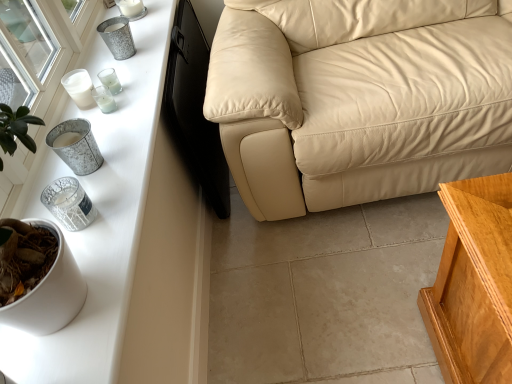
You are a GUI agent. You are given a task and a screenshot of the screen. Output one action in this format:
    pyautogui.click(x=<x>, y=<y>)
    Task: Click on the vacant space in front of metallic candle holder at upper left, the 4th candle holder when ordered from bottom to top
    This screenshot has width=512, height=384.
    Given the screenshot: What is the action you would take?
    pyautogui.click(x=104, y=142)